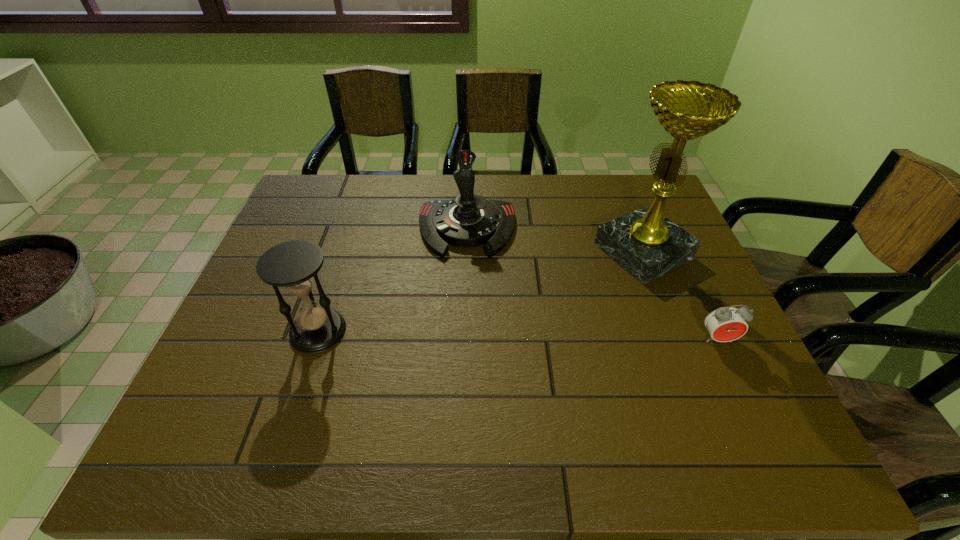
This screenshot has width=960, height=540. Identify the location of object that ranks as the closest to the alarm clock. (644, 242).

Locate which object ranks third in proximity to the award. Please provide its 2D coordinates. Your answer should be formatted as a tuple, i.e. [(x, y)], where the tuple contains the x and y coordinates of a point satisfying the conditions above.

[(293, 265)]